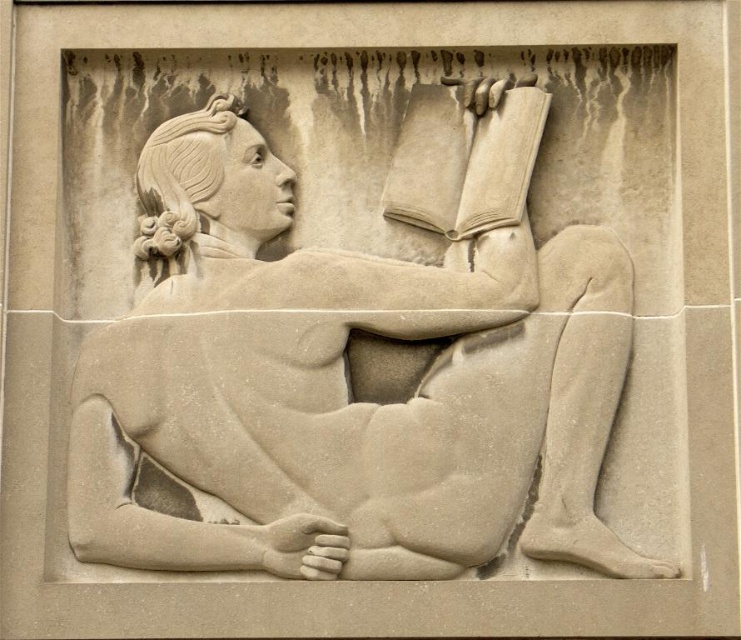
Question: Is sandstone statue of reclining figure reading at center to the left of smooth beige book at upper center from the viewer's perspective?

Choices:
 (A) no
 (B) yes

Answer: (B)

Question: Is sandstone statue of reclining figure reading at center below smooth beige book at upper center?

Choices:
 (A) yes
 (B) no

Answer: (A)

Question: Does sandstone statue of reclining figure reading at center appear under smooth beige book at upper center?

Choices:
 (A) yes
 (B) no

Answer: (A)

Question: Among these points, which one is nearest to the camera?

Choices:
 (A) (419, 125)
 (B) (602, 557)

Answer: (B)